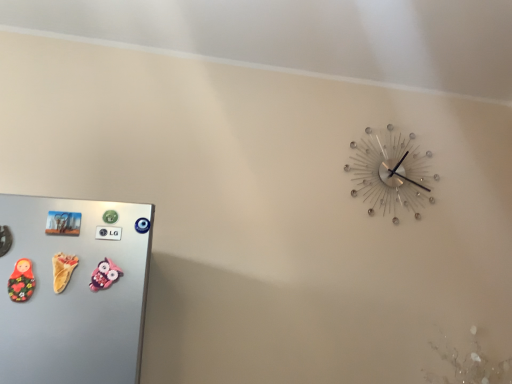
Question: Is point (372, 137) positioned closer to the camera than point (22, 278)?

Choices:
 (A) farther
 (B) closer

Answer: (A)

Question: Considering the positions of metallic silver clock at upper right and matte wooden doll at left, which ranks as the third toy in right-to-left order, in the image, is metallic silver clock at upper right wider or thinner than matte wooden doll at left, which ranks as the third toy in right-to-left order,?

Choices:
 (A) thin
 (B) wide

Answer: (B)

Question: Which is nearer to the metallic silver clock at upper right?

Choices:
 (A) pink fabric owl at lower left, which is the 3th toy in left-to-right order
 (B) matte wooden doll at left, which ranks as the third toy in right-to-left order
 (C) yellow rubber duck at left, which is the 2th toy in right-to-left order

Answer: (A)

Question: Which object is the farthest from the metallic silver clock at upper right?

Choices:
 (A) matte wooden doll at left, which is counted as the first toy, starting from the left
 (B) yellow rubber duck at left, which is the 2th toy in right-to-left order
 (C) pink fabric owl at lower left, the 1th toy in the right-to-left sequence

Answer: (A)